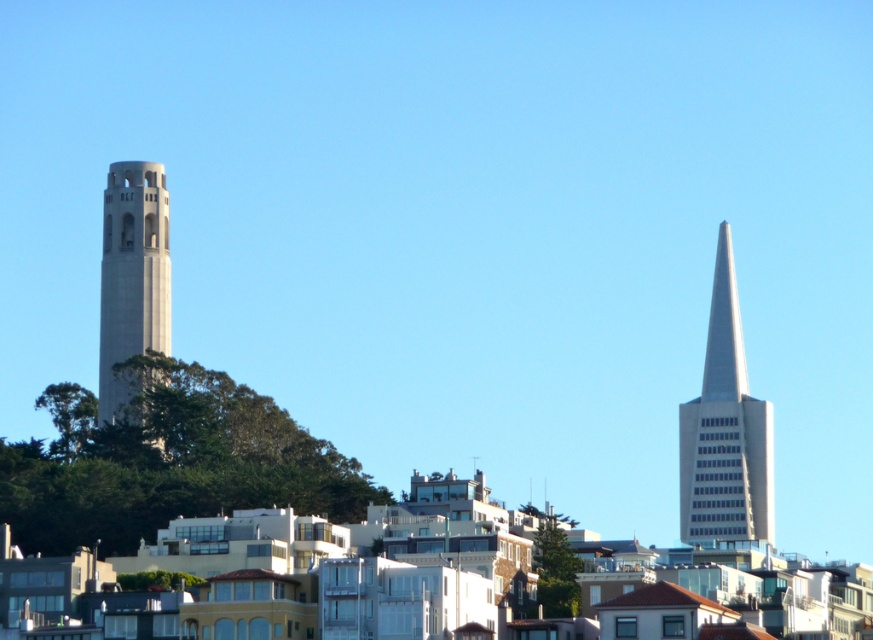
From the picture: You are an urban planner analyzing the city layout. You notice a point marked at coordinates (x=725, y=429). Based on the scene description, what does this point likely indicate?

The point at coordinates (x=725, y=429) marks the location of the silver metallic spire at right, which is part of the modern angular skyscraper with a pointed top described in the scene.

You are a drone operator planning to fly a drone from the silver metallic spire at right to the white concrete tower at left. Based on their positions, which direction should the drone move to reach its destination?

The silver metallic spire at right is closer to the viewer than the white concrete tower at left, so the drone should move backward to reach the white concrete tower at left.

You are a city planner evaluating the skyline. Given the image, which structure, the silver metallic spire at right or the white concrete tower at left, would cast a longer shadow during midday when the sun is directly overhead?

The silver metallic spire at right is taller than the white concrete tower at left, so it would cast a longer shadow during midday when the sun is directly overhead.